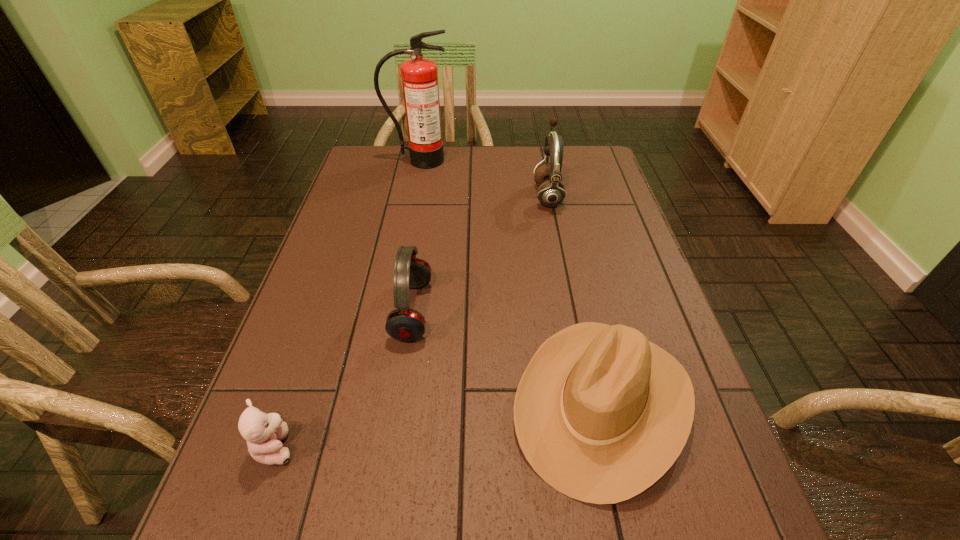
I want to click on free space located 0.100m on the ear pads of the right earphone, so click(500, 195).

Find the location of `free region located 0.050m on the ear pads of the right earphone`. free region located 0.050m on the ear pads of the right earphone is located at coordinates [517, 195].

You are a GUI agent. You are given a task and a screenshot of the screen. Output one action in this format:
    pyautogui.click(x=<x>, y=<y>)
    Task: Click on the free location located on the ear pads of the right earphone
    Image resolution: width=960 pixels, height=540 pixels.
    Given the screenshot: What is the action you would take?
    point(408,195)

You are a GUI agent. You are given a task and a screenshot of the screen. Output one action in this format:
    pyautogui.click(x=<x>, y=<y>)
    Task: Click on the vacant space located on the ear cups of the left earphone
    This screenshot has height=540, width=960.
    Given the screenshot: What is the action you would take?
    pyautogui.click(x=505, y=311)

The image size is (960, 540). I want to click on free space located on the back of the second shortest object, so click(x=571, y=265).

In order to click on vacant space located at the face of the leftmost object in this screenshot , I will do coord(434,447).

Find the location of a particular element. fire extinguisher that is at the far edge is located at coordinates (419, 75).

Locate an element on the screen. earphone positioned at the far edge is located at coordinates (551, 193).

Identify the location of fire extinguisher at the left edge. (419, 75).

Identify the location of teddy bear positioned at the left edge. The height and width of the screenshot is (540, 960). (263, 432).